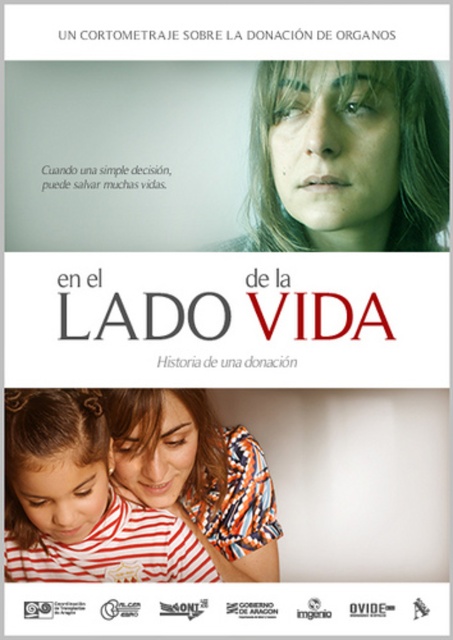
Question: Is green matte face at upper center bigger than striped cotton shirt at center?

Choices:
 (A) yes
 (B) no

Answer: (B)

Question: Which object appears farthest from the camera in this image?

Choices:
 (A) green matte face at upper center
 (B) striped cotton shirt at center

Answer: (B)

Question: Can you confirm if striped cotton shirt at lower left is wider than striped cotton shirt at center?

Choices:
 (A) no
 (B) yes

Answer: (B)

Question: Which of the following is the closest to the observer?

Choices:
 (A) (350, 113)
 (B) (19, 577)
 (C) (174, 435)

Answer: (A)

Question: Considering the real-world distances, which object is closest to the green matte face at upper center?

Choices:
 (A) striped cotton shirt at center
 (B) striped cotton shirt at lower left

Answer: (A)

Question: Does green matte face at upper center appear on the right side of striped cotton shirt at center?

Choices:
 (A) yes
 (B) no

Answer: (A)